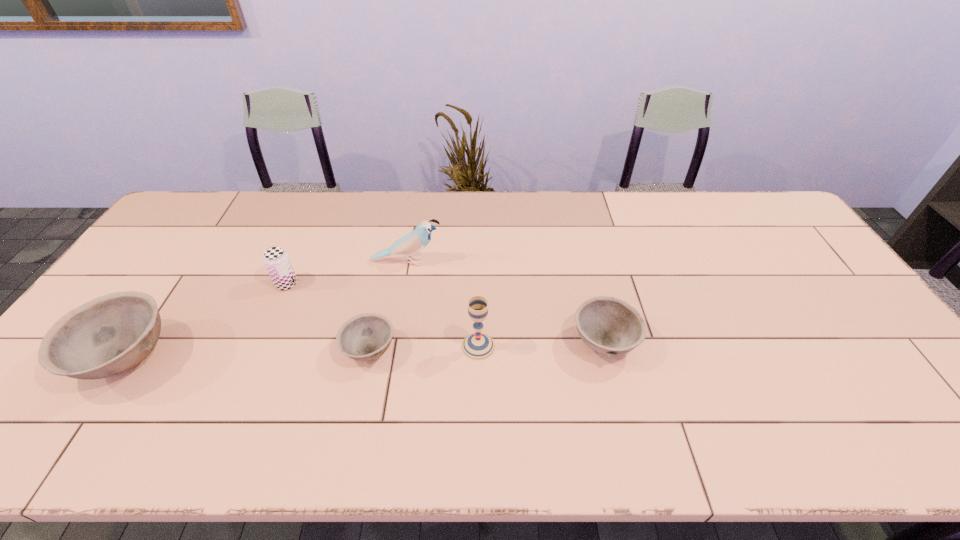
Locate an element on the screen. This screenshot has width=960, height=540. vacant point located between the shortest bowl and the chalice is located at coordinates (424, 348).

The width and height of the screenshot is (960, 540). What are the coordinates of `empty space between the chalice and the shortest bowl` in the screenshot? It's located at [x=424, y=348].

Find the location of a particular element. The width and height of the screenshot is (960, 540). the fourth closest object to the shortest bowl is located at coordinates (109, 335).

The width and height of the screenshot is (960, 540). Identify the location of object that ranks as the closest to the farthest object. 276,259.

Locate an element on the screen. bowl that is the second closest to the bird is located at coordinates click(608, 325).

This screenshot has width=960, height=540. I want to click on the second closest bowl to the bird, so click(608, 325).

At what (x,y) coordinates should I click in order to perform the action: click on free spot that satisfies the following two spatial constraints: 1. on the back side of the chalice; 2. on the right side of the rightmost bowl. Please return your answer as a coordinate pair (x, y). The image size is (960, 540). Looking at the image, I should click on (478, 342).

Find the location of a particular element. vacant point that satisfies the following two spatial constraints: 1. at the face of the bird; 2. on the front side of the second object from left to right is located at coordinates (403, 284).

Identify the location of free spot that satisfies the following two spatial constraints: 1. at the face of the bird; 2. on the back side of the rightmost object. Image resolution: width=960 pixels, height=540 pixels. (393, 342).

Find the location of a particular element. The height and width of the screenshot is (540, 960). free space in the image that satisfies the following two spatial constraints: 1. at the face of the farthest object; 2. on the front side of the leftmost bowl is located at coordinates (391, 358).